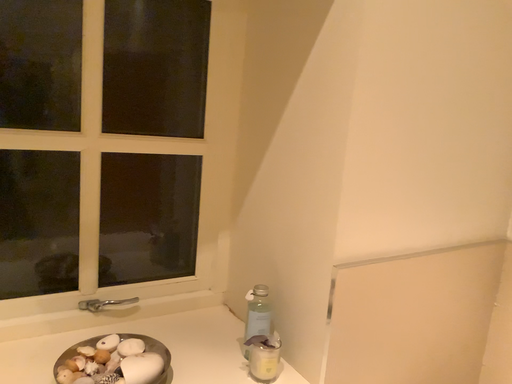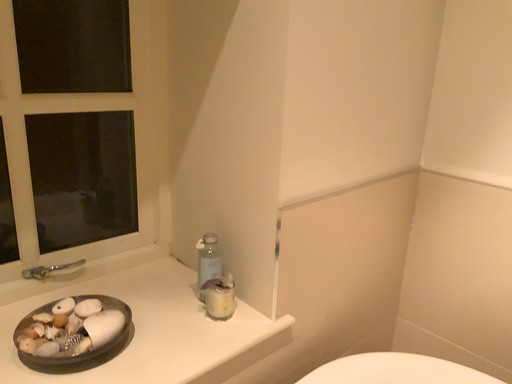
Question: How did the camera likely rotate when shooting the video?

Choices:
 (A) rotated downward
 (B) rotated upward

Answer: (A)